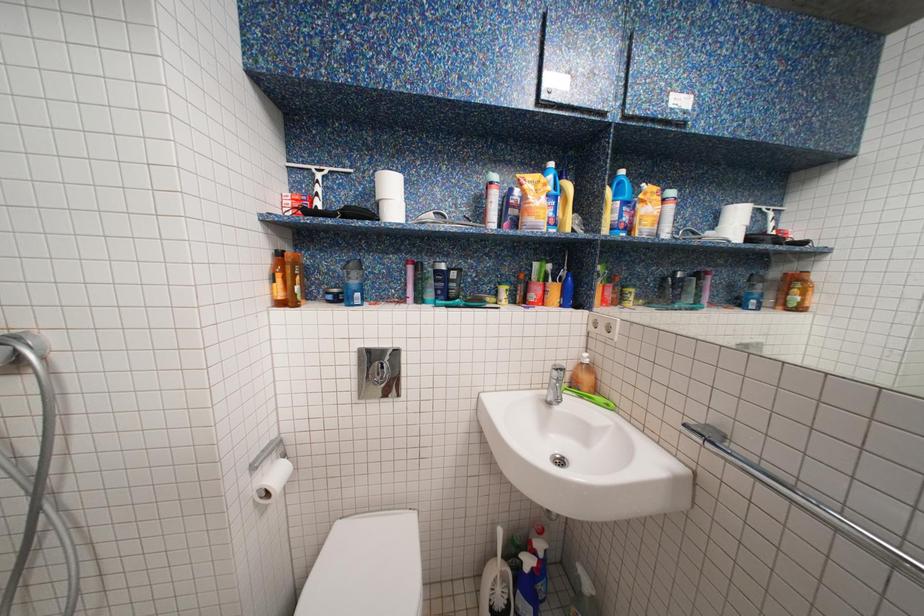
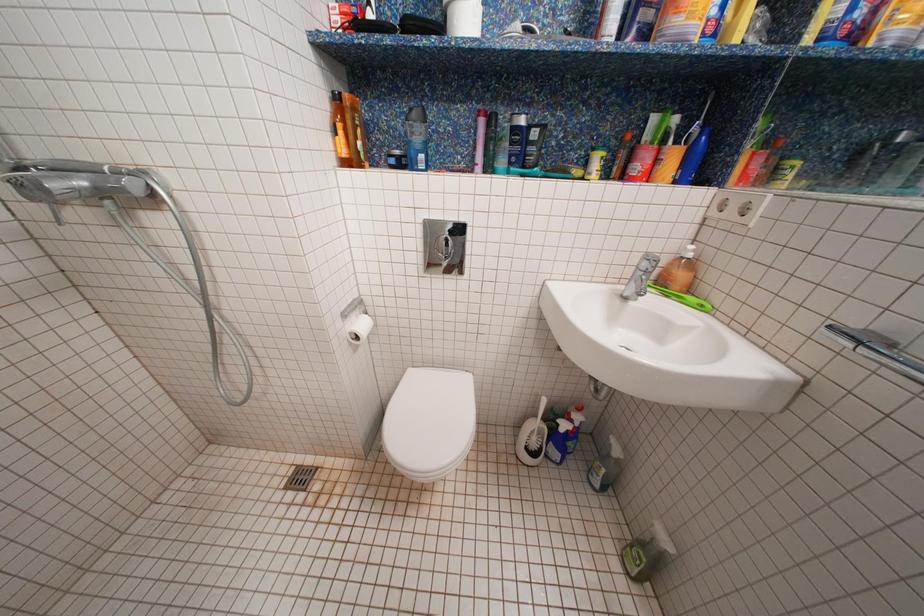
Question: Based on the continuous images, in which direction is the camera rotating? Reply with the corresponding letter.

Choices:
 (A) Left
 (B) Right
 (C) Up
 (D) Down

Answer: (D)